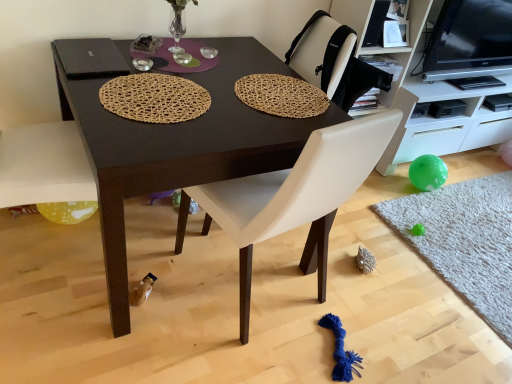
Where is `vacant region to the right of white leather chair at center`? This screenshot has height=384, width=512. vacant region to the right of white leather chair at center is located at coordinates click(374, 298).